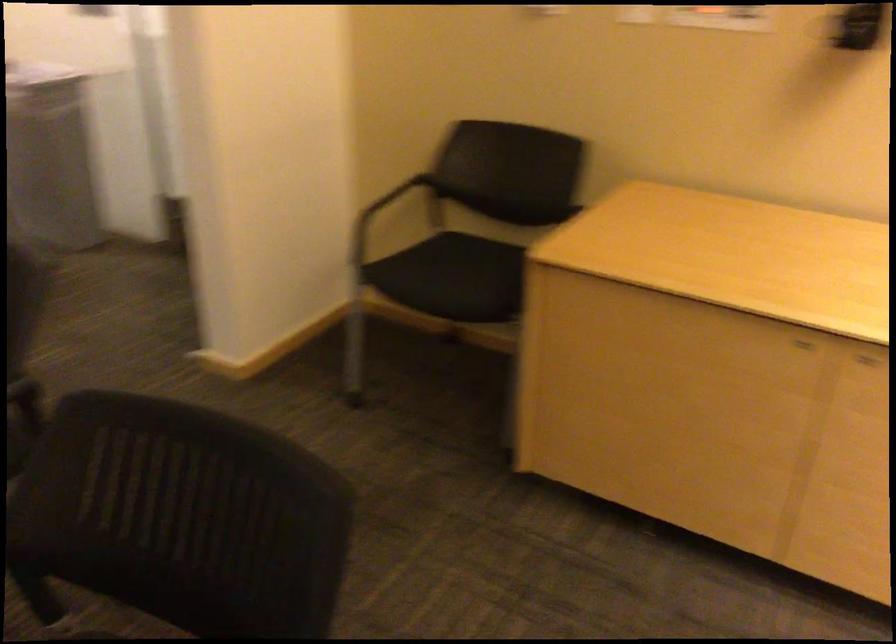
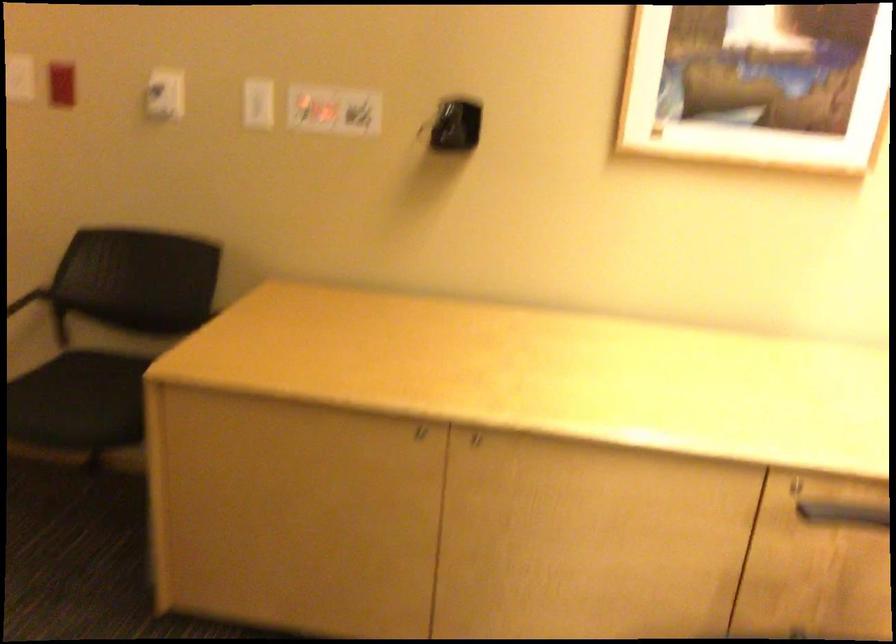
Locate, in the second image, the point that corresponds to pixel 468 245 in the first image.

(101, 373)